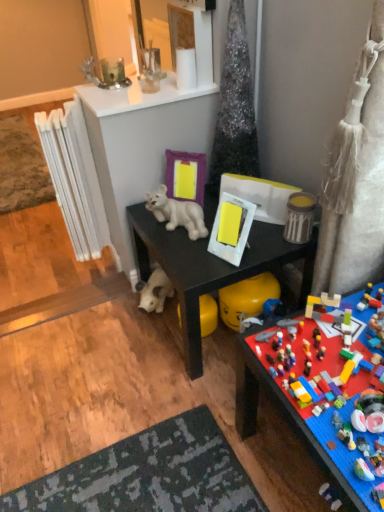
This screenshot has height=512, width=384. Identify the location of unoccupied area in front of white plush toy at lower center, which is the 2th toy from bottom to top. (156, 336).